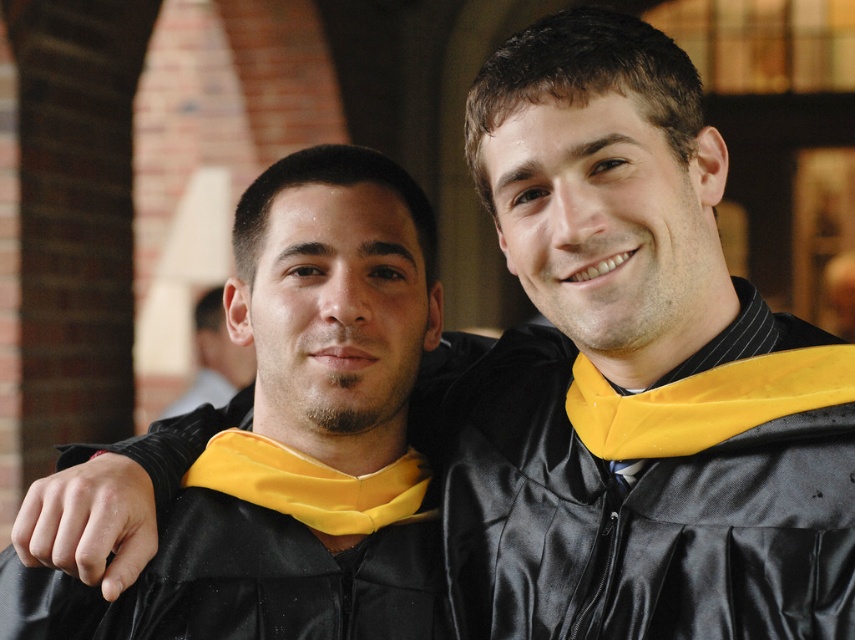
Is matte black graduation gown at center positioned before matte black ear at center?

Yes, matte black graduation gown at center is in front of matte black ear at center.

Who is more forward, (136,465) or (215,305)?

Point (136,465) is in front.

Describe the element at coordinates (286, 436) in the screenshot. I see `matte black graduation gown at center` at that location.

Locate an element on the screen. This screenshot has height=640, width=855. matte black graduation gown at center is located at coordinates (286, 436).